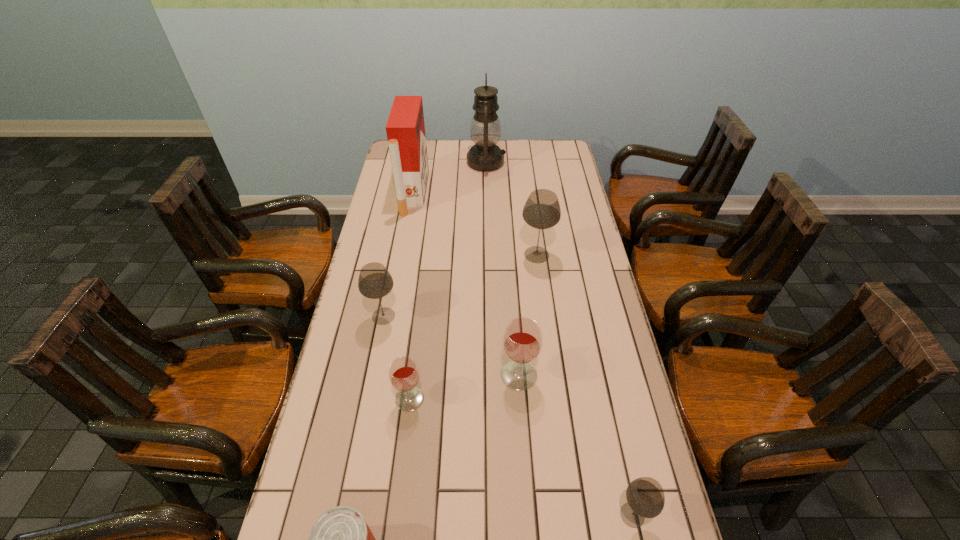
In order to click on the rightmost object in this screenshot , I will do `click(645, 497)`.

The height and width of the screenshot is (540, 960). Find the location of `the smallest gray wineglass`. the smallest gray wineglass is located at coordinates (645, 497).

This screenshot has height=540, width=960. In order to click on blank area located on the front of the oil lamp in this screenshot , I will do `click(487, 190)`.

Find the location of a particular element. vacant space located 0.300m on the front-facing side of the cigarette case is located at coordinates (496, 193).

Identify the location of vacant area situated on the front of the biggest gray wineglass. The image size is (960, 540). (544, 313).

This screenshot has width=960, height=540. In order to click on blank space located 0.180m on the front of the right red wineglass in this screenshot , I will do `click(524, 457)`.

This screenshot has height=540, width=960. What are the coordinates of `vacant region located on the back of the second smallest gray wineglass` in the screenshot? It's located at (393, 269).

Where is `vacant space situated on the left of the left red wineglass`? Image resolution: width=960 pixels, height=540 pixels. vacant space situated on the left of the left red wineglass is located at coordinates pyautogui.click(x=370, y=399).

The height and width of the screenshot is (540, 960). In order to click on free space located on the left of the nearest wineglass in this screenshot , I will do `click(532, 515)`.

At what (x,y) coordinates should I click in order to perform the action: click on object that is at the far edge. Please return your answer as a coordinate pair (x, y). The image size is (960, 540). Looking at the image, I should click on (485, 155).